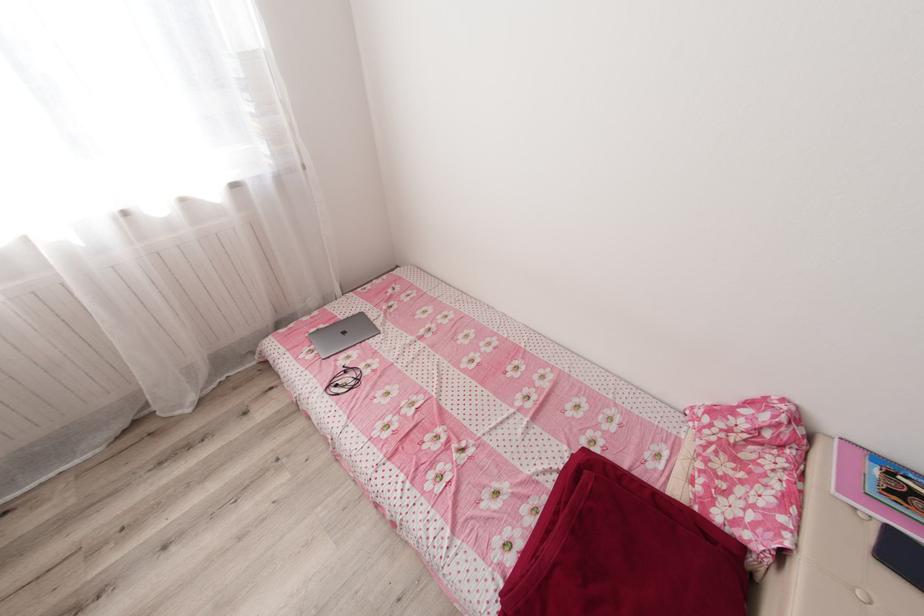
The image size is (924, 616). I want to click on dark phone case, so click(x=900, y=553).